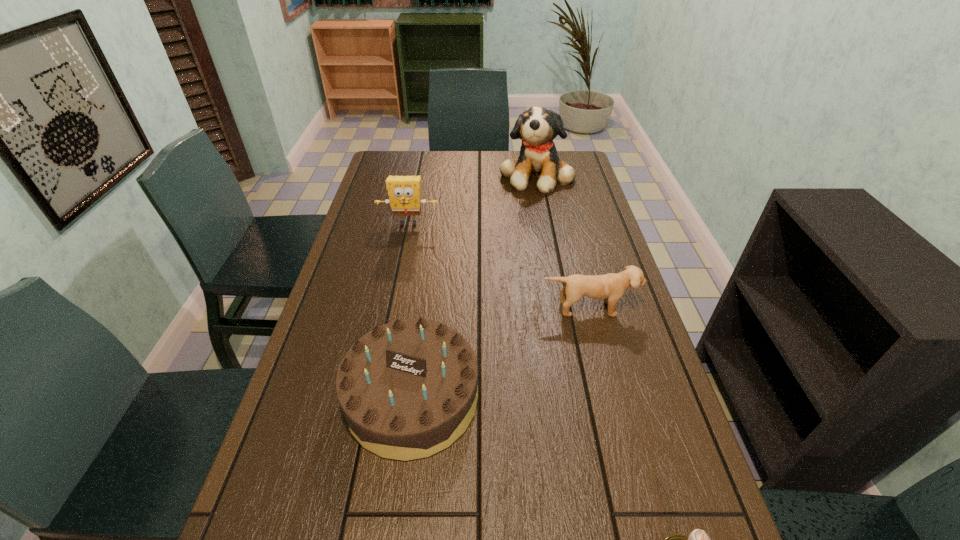
Identify the location of the farther puppy. The width and height of the screenshot is (960, 540). (537, 127).

You are a GUI agent. You are given a task and a screenshot of the screen. Output one action in this format:
    pyautogui.click(x=<x>, y=<y>)
    Task: Click on the farthest object
    
    Given the screenshot: What is the action you would take?
    pyautogui.click(x=537, y=127)

In order to click on the second farthest object in this screenshot , I will do `click(404, 192)`.

This screenshot has width=960, height=540. I want to click on birthday cake, so click(408, 389).

You are a GUI agent. You are given a task and a screenshot of the screen. Output one action in this format:
    pyautogui.click(x=<x>, y=<y>)
    Task: Click on the shorter puppy
    This screenshot has width=960, height=540.
    Given the screenshot: What is the action you would take?
    pyautogui.click(x=610, y=287)

Image resolution: width=960 pixels, height=540 pixels. Find the location of `the nearer puppy`. the nearer puppy is located at coordinates (610, 287).

Where is `free space located at the face of the farthest object`? This screenshot has height=540, width=960. free space located at the face of the farthest object is located at coordinates (547, 234).

Where is `free space located on the face of the sponge`? The image size is (960, 540). free space located on the face of the sponge is located at coordinates (392, 306).

You are a GUI agent. You are given a task and a screenshot of the screen. Output one action in this format:
    pyautogui.click(x=<x>, y=<y>)
    Task: Click on the free space located 0.100m on the front-facing side of the fourth farthest object
    The height and width of the screenshot is (540, 960).
    Given the screenshot: What is the action you would take?
    pyautogui.click(x=396, y=516)

Where is `vacant area situated on the left side of the shorter puppy`? The width and height of the screenshot is (960, 540). vacant area situated on the left side of the shorter puppy is located at coordinates (617, 420).